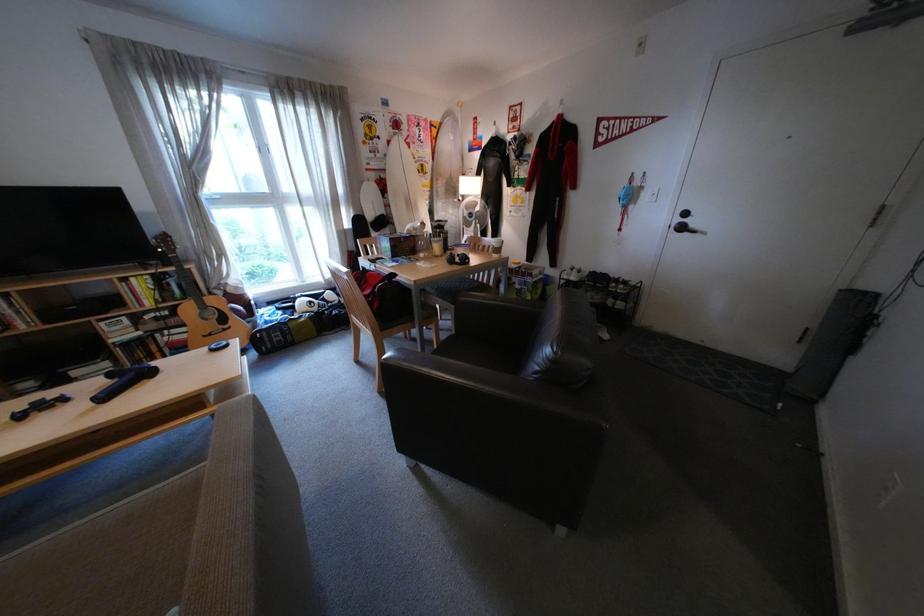
Where would you rest the sofa armrest? Please return your answer as a coordinate pair (x, y).

(578, 439)